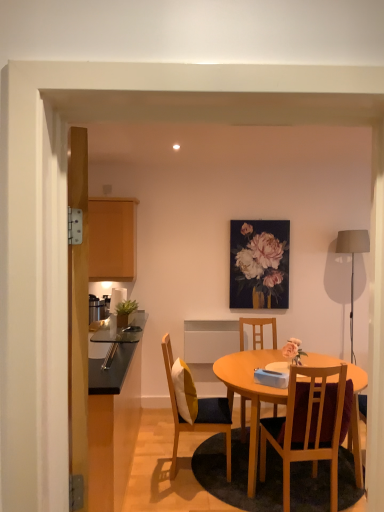
Question: Should I look upward or downward to see matte wood cabinet at left?

Choices:
 (A) up
 (B) down

Answer: (A)

Question: Is wooden chair at center, the 3th chair in the back-to-front sequence, smaller than matte gray fabric lampshade at right?

Choices:
 (A) yes
 (B) no

Answer: (B)

Question: Does wooden chair at center, which appears as the 1th chair when viewed from the front, appear on the left side of matte gray fabric lampshade at right?

Choices:
 (A) yes
 (B) no

Answer: (A)

Question: From a real-world perspective, is wooden chair at center, placed as the 3th chair when sorted from left to right, under matte gray fabric lampshade at right?

Choices:
 (A) no
 (B) yes

Answer: (B)

Question: Considering the relative sizes of wooden chair at center, which appears as the 1th chair when viewed from the front, and matte gray fabric lampshade at right in the image provided, is wooden chair at center, which appears as the 1th chair when viewed from the front, wider than matte gray fabric lampshade at right?

Choices:
 (A) yes
 (B) no

Answer: (A)

Question: Considering the relative positions of wooden chair at center, which appears as the 1th chair when viewed from the front, and matte gray fabric lampshade at right in the image provided, is wooden chair at center, which appears as the 1th chair when viewed from the front, behind matte gray fabric lampshade at right?

Choices:
 (A) no
 (B) yes

Answer: (A)

Question: From the image's perspective, is wooden chair at center, which appears as the 1th chair when viewed from the front, above matte gray fabric lampshade at right?

Choices:
 (A) yes
 (B) no

Answer: (B)

Question: Is wooden chair with cushion at center, the 1th chair from the left, touching wooden table at center?

Choices:
 (A) yes
 (B) no

Answer: (B)

Question: Is wooden chair with cushion at center, the 1th chair from the left, oriented towards wooden table at center?

Choices:
 (A) yes
 (B) no

Answer: (A)

Question: From a real-world perspective, is wooden chair with cushion at center, arranged as the 3th chair when viewed from the right, beneath wooden table at center?

Choices:
 (A) no
 (B) yes

Answer: (A)

Question: Is wooden chair with cushion at center, arranged as the 3th chair when viewed from the right, far from wooden table at center?

Choices:
 (A) yes
 (B) no

Answer: (B)

Question: Is wooden table at center at the back of wooden chair with cushion at center, arranged as the 3th chair when viewed from the right?

Choices:
 (A) yes
 (B) no

Answer: (B)

Question: From a real-world perspective, is wooden chair with cushion at center, arranged as the 3th chair when viewed from the right, physically above wooden table at center?

Choices:
 (A) yes
 (B) no

Answer: (A)

Question: Can you confirm if wooden table at center is bigger than wooden chair with cushion at center, the 2th chair positioned from the front?

Choices:
 (A) yes
 (B) no

Answer: (A)